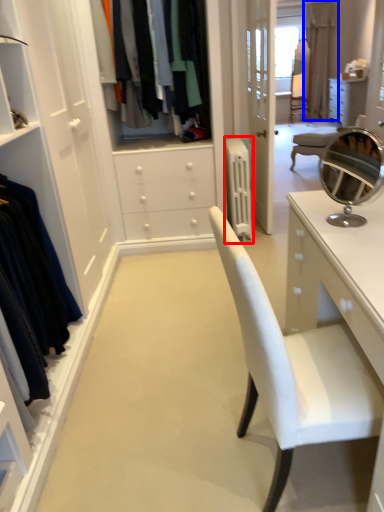
Question: Which point is closer to the camera, radiator (highlighted by a red box) or curtain (highlighted by a blue box)?

Choices:
 (A) radiator
 (B) curtain

Answer: (A)